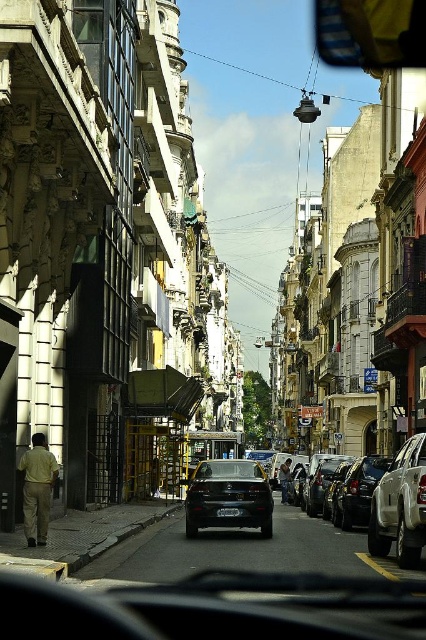
Question: Is white matte car at right closer to the viewer compared to light brown leather jacket at center?

Choices:
 (A) yes
 (B) no

Answer: (A)

Question: Does white matte car at right have a lesser width compared to light brown leather jacket at center?

Choices:
 (A) yes
 (B) no

Answer: (A)

Question: Where is white matte car at right located in relation to light brown leather jacket at center in the image?

Choices:
 (A) below
 (B) above

Answer: (B)

Question: Considering the real-world distances, which object is farthest from the shiny black sedan at right?

Choices:
 (A) satin black sedan at center
 (B) light brown leather jacket at center
 (C) white matte car at right

Answer: (B)

Question: Which point is closer to the camera taking this photo?

Choices:
 (A) (236, 509)
 (B) (189, 499)
 (C) (285, 496)
 (D) (339, 486)

Answer: (A)

Question: Which of these objects is positioned farthest from the shiny black sedan at right?

Choices:
 (A) light brown fabric man at lower left
 (B) white matte car at right

Answer: (A)